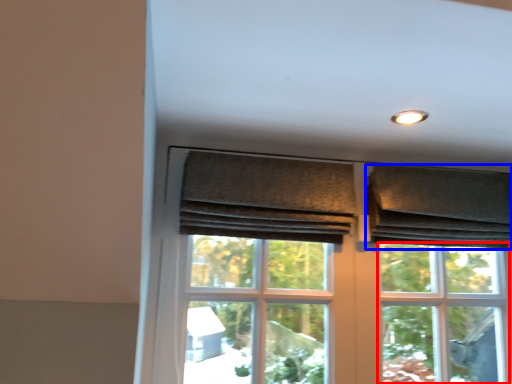
Question: Which object is closer to the camera taking this photo, bay window (highlighted by a red box) or curtain (highlighted by a blue box)?

Choices:
 (A) bay window
 (B) curtain

Answer: (A)